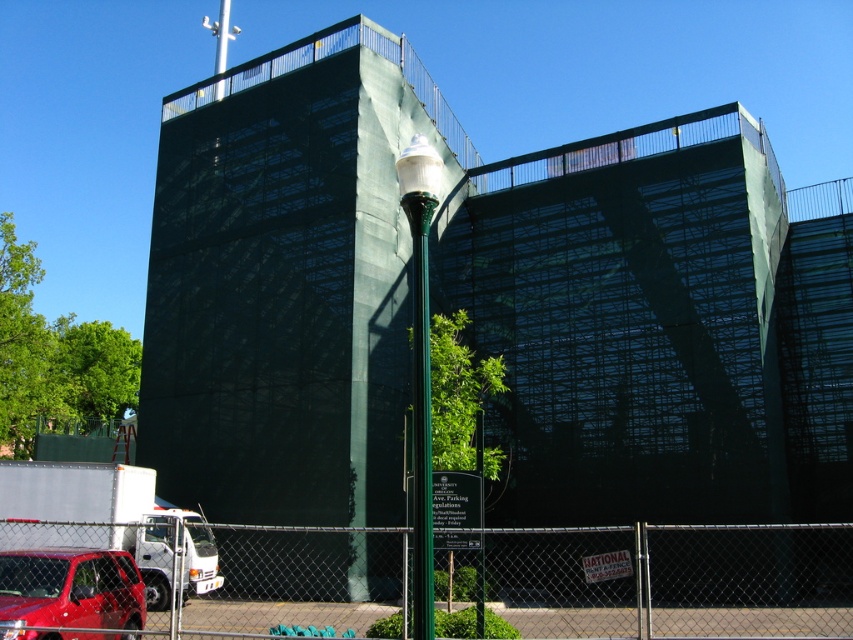
Between metal chain-link fence at lower left and shiny red suv at lower left, which one appears on the right side from the viewer's perspective?

metal chain-link fence at lower left is more to the right.

Between metal chain-link fence at lower left and shiny red suv at lower left, which one is positioned lower?

metal chain-link fence at lower left

Describe the element at coordinates (672, 579) in the screenshot. Image resolution: width=853 pixels, height=640 pixels. I see `metal chain-link fence at lower left` at that location.

Locate an element on the screen. Image resolution: width=853 pixels, height=640 pixels. metal chain-link fence at lower left is located at coordinates (672, 579).